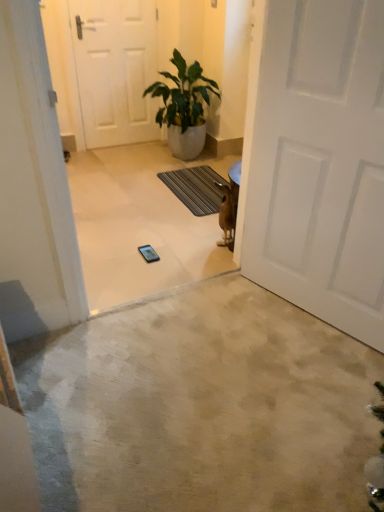
Locate an element on the screen. The image size is (384, 512). empty space that is ontop of dark gray textured mat at center (from a real-world perspective) is located at coordinates (195, 181).